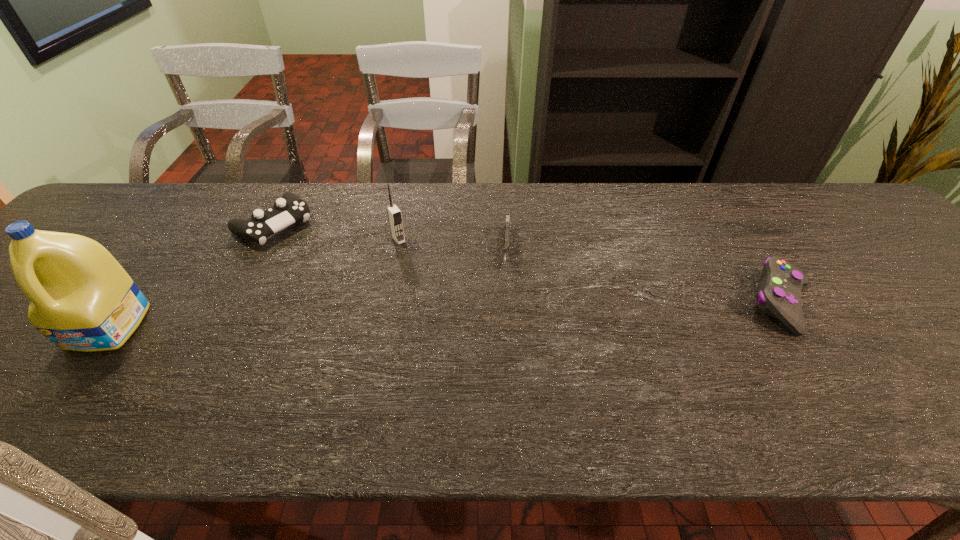
I want to click on free space located on the surface of the farther control, so click(361, 289).

Where is `gun located at the far edge`? gun located at the far edge is located at coordinates [507, 225].

Where is `control at the far edge`? This screenshot has height=540, width=960. control at the far edge is located at coordinates (289, 209).

The width and height of the screenshot is (960, 540). Find the location of `vacant space at the far edge of the desktop`. vacant space at the far edge of the desktop is located at coordinates (204, 205).

This screenshot has height=540, width=960. Identify the location of free space at the far right corner of the desktop. (806, 186).

Locate an element on the screen. The width and height of the screenshot is (960, 540). free space between the fourth shortest object and the farther control is located at coordinates (336, 232).

Locate an element on the screen. free space between the third object from left to right and the farther control is located at coordinates (336, 232).

Where is `free space that is in between the cellular telephone and the gun`? free space that is in between the cellular telephone and the gun is located at coordinates (453, 244).

You are a GUI agent. You are given a task and a screenshot of the screen. Output one action in this format:
    pyautogui.click(x=<x>, y=<y>)
    Task: Click on the vacant area between the detergent and the rightmost object
    
    Given the screenshot: What is the action you would take?
    pyautogui.click(x=445, y=315)

Image resolution: width=960 pixels, height=540 pixels. Find the location of `empty location between the right control and the left control`. empty location between the right control and the left control is located at coordinates (528, 264).